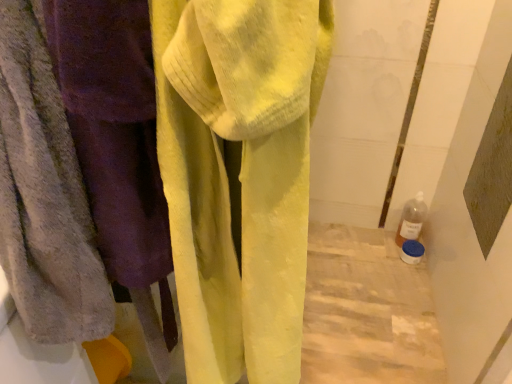
I want to click on translucent plastic bottle at lower right, so click(411, 219).

The height and width of the screenshot is (384, 512). Describe the element at coordinates (411, 219) in the screenshot. I see `translucent plastic bottle at lower right` at that location.

Locate an element on the screen. The height and width of the screenshot is (384, 512). translucent plastic bottle at lower right is located at coordinates (411, 219).